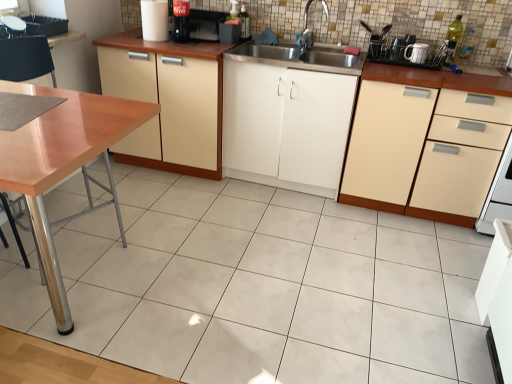
Question: Is wooden table at left spatially inside white glossy mug at upper right, or outside of it?

Choices:
 (A) outside
 (B) inside

Answer: (A)

Question: In terms of size, does wooden table at left appear bigger or smaller than white glossy mug at upper right?

Choices:
 (A) big
 (B) small

Answer: (A)

Question: Which is nearer to the white glossy mug at upper right?

Choices:
 (A) white ceramic mug at upper right, which appears as the first appliance when viewed from the right
 (B) black plastic dish rack at upper right, acting as the third appliance starting from the left
 (C) beige matte cabinet at right, the 3th cabinetry positioned from the left
 (D) wooden table at left
 (E) silver metallic faucet at upper center

Answer: (A)

Question: Which object is positioned farthest from the white glossy coffee cup at upper left, which is counted as the 4th appliance, starting from the right?

Choices:
 (A) white ceramic mug at upper right, the fourth appliance in the left-to-right sequence
 (B) wooden table at left
 (C) white glossy cup at upper center, arranged as the third appliance when viewed from the right
 (D) beige wood cabinet at center, which is the 1th cabinetry in left-to-right order
 (E) white matte cabinet at center, which is the 2th cabinetry in right-to-left order

Answer: (A)